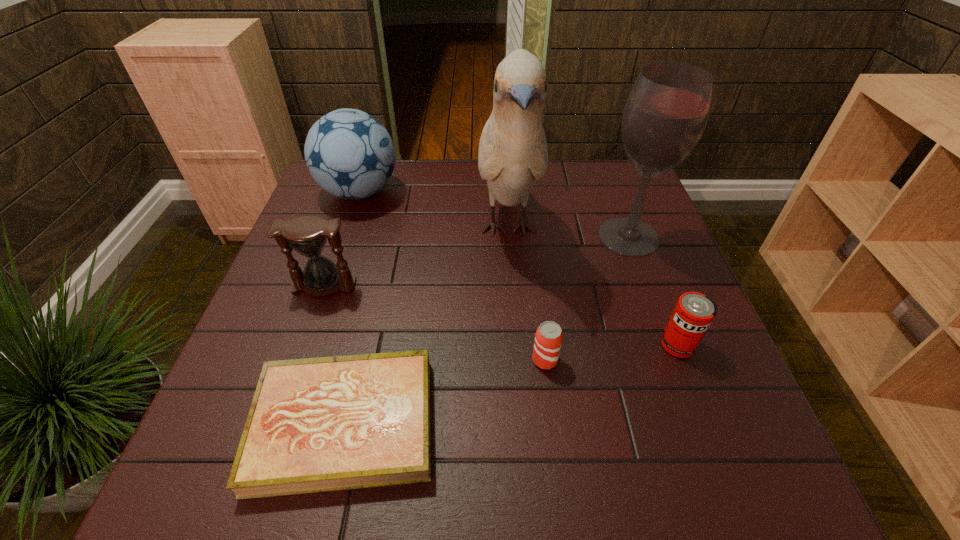
You are a GUI agent. You are given a task and a screenshot of the screen. Output one action in this format:
    pyautogui.click(x=<x>, y=<y>)
    Task: Click on the object identified as the fifth closest to the hourglass
    
    Given the screenshot: What is the action you would take?
    pyautogui.click(x=667, y=111)

The height and width of the screenshot is (540, 960). Find the location of `object that is the fourth closest to the sixth shortest object`. object that is the fourth closest to the sixth shortest object is located at coordinates (321, 424).

Where is `vacant area in the image that satisfies the following two spatial constraints: 1. on the front side of the fourth shortest object; 2. on the right side of the beer can`? Image resolution: width=960 pixels, height=540 pixels. vacant area in the image that satisfies the following two spatial constraints: 1. on the front side of the fourth shortest object; 2. on the right side of the beer can is located at coordinates (299, 360).

Where is `free location that satisfies the following two spatial constraints: 1. on the side with brand of the hardback book; 2. on the right side of the third tallest object`? This screenshot has height=540, width=960. free location that satisfies the following two spatial constraints: 1. on the side with brand of the hardback book; 2. on the right side of the third tallest object is located at coordinates (281, 424).

The height and width of the screenshot is (540, 960). I want to click on blank space that satisfies the following two spatial constraints: 1. on the face of the parakeet; 2. on the left side of the alcohol, so tap(509, 237).

Find the location of a particular element. The height and width of the screenshot is (540, 960). vacant region that satisfies the following two spatial constraints: 1. on the front side of the alcohol; 2. on the right side of the can is located at coordinates (669, 345).

The height and width of the screenshot is (540, 960). Identify the location of vacant area in the image that satisfies the following two spatial constraints: 1. on the side with brand of the fifth tallest object; 2. on the left side of the third tallest object. (307, 345).

You are a GUI agent. You are given a task and a screenshot of the screen. Output one action in this format:
    pyautogui.click(x=<x>, y=<y>)
    Task: Click on the blank space that satisfies the following two spatial constraints: 1. on the face of the second tallest object; 2. on the left side of the parakeet
    
    Given the screenshot: What is the action you would take?
    pyautogui.click(x=509, y=237)

At what (x,y) coordinates should I click in order to perform the action: click on free space that satisfies the following two spatial constraints: 1. on the side with brand of the soccer ball; 2. on the left side of the alcohol. Please return your answer as a coordinate pair (x, y). This screenshot has height=540, width=960. Looking at the image, I should click on 345,237.

This screenshot has width=960, height=540. I want to click on free spot that satisfies the following two spatial constraints: 1. on the front side of the hourglass; 2. on the left side of the beer can, so click(x=299, y=360).